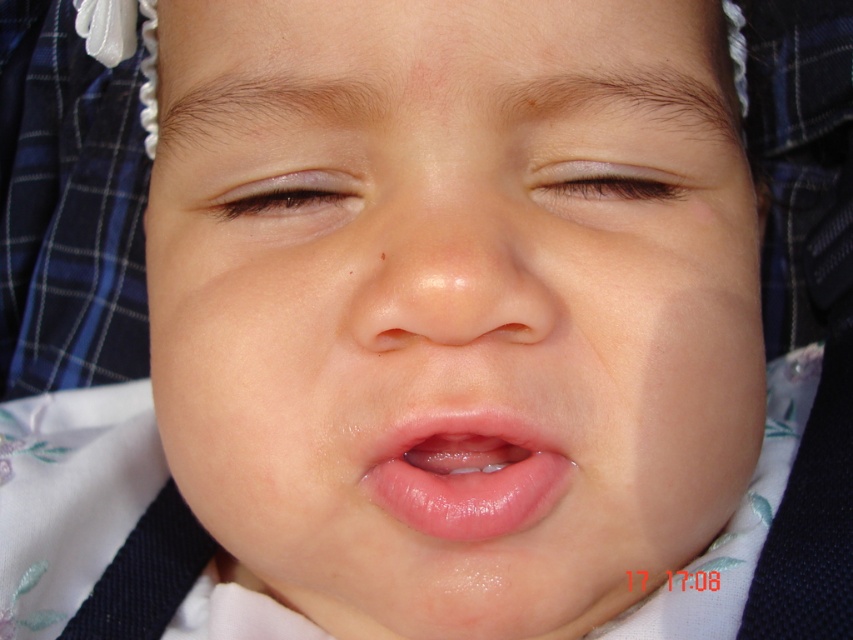
Question: Does smooth flesh-colored nose at center appear on the left side of glossy skin at upper center?

Choices:
 (A) no
 (B) yes

Answer: (B)

Question: Which of these objects is positioned farthest from the smooth flesh-colored nose at center?

Choices:
 (A) brown matte eye at upper left
 (B) glossy skin at upper center
 (C) glossy pink lips at center
 (D) smooth skin face at center

Answer: (D)

Question: Which point appears farthest from the camera in this image?

Choices:
 (A) (531, 582)
 (B) (515, 458)

Answer: (B)

Question: Does glossy pink lips at center appear over glossy skin at upper center?

Choices:
 (A) yes
 (B) no

Answer: (B)

Question: Is glossy pink lips at center wider than brown matte eye at upper left?

Choices:
 (A) yes
 (B) no

Answer: (A)

Question: Which object appears farthest from the camera in this image?

Choices:
 (A) smooth skin face at center
 (B) glossy skin at upper center

Answer: (B)